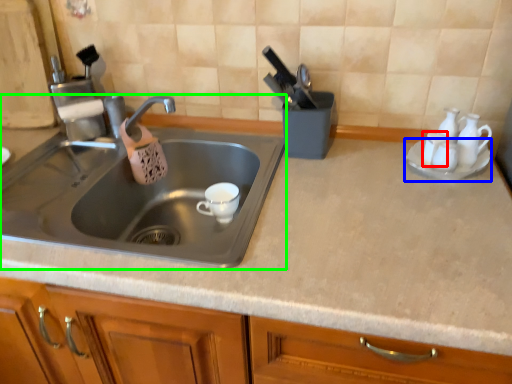
Question: Which object is positioned closest to tableware (highlighted by a red box)? Select from saucer (highlighted by a blue box) and sink (highlighted by a green box).

Choices:
 (A) saucer
 (B) sink

Answer: (A)